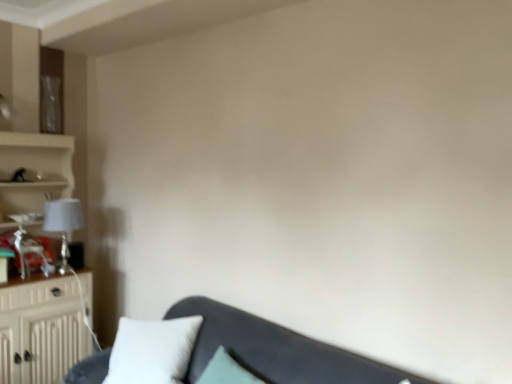
In order to face velvet dark gray couch at lower center, should I rotate leftwards or rightwards?

To face it directly, rotate left by 5.751 degrees.

What do you see at coordinates (152, 351) in the screenshot? The image size is (512, 384). I see `white soft pillow at lower left` at bounding box center [152, 351].

Where is `velvet dark gray couch at lower center`? velvet dark gray couch at lower center is located at coordinates (277, 350).

Can you confirm if velvet dark gray couch at lower center is taller than white soft pillow at lower left?

Yes.

From the picture: Is velvet dark gray couch at lower center not near white soft pillow at lower left?

No, velvet dark gray couch at lower center is in close proximity to white soft pillow at lower left.

How different are the orientations of velvet dark gray couch at lower center and white soft pillow at lower left in degrees?

The angular difference between velvet dark gray couch at lower center and white soft pillow at lower left is 37.4 degrees.

Find the location of a particular element. The image size is (512, 384). studio couch that appears below the white soft pillow at lower left (from a real-world perspective) is located at coordinates (277, 350).

Could velvet dark gray couch at lower center be considered to be inside matte white lampshade at left?

That's incorrect, velvet dark gray couch at lower center is not inside matte white lampshade at left.

Can you confirm if matte white lampshade at left is positioned to the right of velvet dark gray couch at lower center?

No, matte white lampshade at left is not to the right of velvet dark gray couch at lower center.

Considering the positions of objects white soft pillow at lower left and matte white lampshade at left in the image provided, who is behind, white soft pillow at lower left or matte white lampshade at left?

Positioned behind is matte white lampshade at left.

Can you confirm if white soft pillow at lower left is thinner than matte white lampshade at left?

Incorrect, the width of white soft pillow at lower left is not less than that of matte white lampshade at left.

From a real-world perspective, is white soft pillow at lower left positioned above or below matte white lampshade at left?

In terms of real-world spatial position, white soft pillow at lower left is below matte white lampshade at left.

Is white soft pillow at lower left taller than matte white lampshade at left?

Yes.

From a real-world perspective, is white soft pillow at lower left located higher than velvet dark gray couch at lower center?

Indeed, from a real-world perspective, white soft pillow at lower left stands above velvet dark gray couch at lower center.

The image size is (512, 384). What are the coordinates of `studio couch below the white soft pillow at lower left (from the image's perspective)` in the screenshot? It's located at (277, 350).

Is white soft pillow at lower left far from velvet dark gray couch at lower center?

No, white soft pillow at lower left is not far from velvet dark gray couch at lower center.

What's the angular difference between white soft pillow at lower left and velvet dark gray couch at lower center's facing directions?

37.4 degrees.

Does point (236, 353) come behind point (52, 205)?

No, it is not.

Is velvet dark gray couch at lower center at the right side of matte white lampshade at left?

Indeed, velvet dark gray couch at lower center is positioned on the right side of matte white lampshade at left.

Which of these two, velvet dark gray couch at lower center or matte white lampshade at left, is smaller?

With smaller size is matte white lampshade at left.

Can we say white soft pillow at lower left lies outside beige wood cabinet at left?

Indeed, white soft pillow at lower left is completely outside beige wood cabinet at left.

From the image's perspective, is white soft pillow at lower left located beneath beige wood cabinet at left?

Yes, from the image's perspective, white soft pillow at lower left is below beige wood cabinet at left.

Is the depth of white soft pillow at lower left less than that of beige wood cabinet at left?

That is True.

How many degrees apart are the facing directions of white soft pillow at lower left and beige wood cabinet at left?

The angular difference between white soft pillow at lower left and beige wood cabinet at left is 53.5 degrees.

From a real-world perspective, which object stands above the other?

Result: matte white lampshade at left.

Locate an element on the screen. This screenshot has height=384, width=512. lamp that is above the beige wood cabinet at left (from a real-world perspective) is located at coordinates (63, 224).

How different are the orientations of matte white lampshade at left and beige wood cabinet at left in degrees?

They differ by 0.00405 degrees in their facing directions.

From the image's perspective, which one is positioned lower, matte white lampshade at left or beige wood cabinet at left?

From the image's view, beige wood cabinet at left is below.

Locate an element on the screen. Image resolution: width=512 pixels, height=384 pixels. pillow above the velvet dark gray couch at lower center (from a real-world perspective) is located at coordinates (152, 351).

The image size is (512, 384). In order to click on lamp behind the velvet dark gray couch at lower center in this screenshot , I will do `click(63, 224)`.

Looking at the image, which one is located further to velvet dark gray couch at lower center, white soft pillow at lower left or matte white lampshade at left?

The object further to velvet dark gray couch at lower center is matte white lampshade at left.

Looking at the image, which one is located closer to white soft pillow at lower left, matte white lampshade at left or velvet dark gray couch at lower center?

velvet dark gray couch at lower center lies closer to white soft pillow at lower left than the other object.

Considering their positions, is beige wood cabinet at left positioned further to matte white lampshade at left than white soft pillow at lower left?

The object further to matte white lampshade at left is white soft pillow at lower left.

From the image, which object appears to be farther from velvet dark gray couch at lower center, white soft pillow at lower left or beige wood cabinet at left?

beige wood cabinet at left is further to velvet dark gray couch at lower center.

Considering their positions, is beige wood cabinet at left positioned further to white soft pillow at lower left than velvet dark gray couch at lower center?

beige wood cabinet at left.

Which object lies further to the anchor point beige wood cabinet at left, matte white lampshade at left or velvet dark gray couch at lower center?

Based on the image, velvet dark gray couch at lower center appears to be further to beige wood cabinet at left.

From the image, which object appears to be nearer to velvet dark gray couch at lower center, matte white lampshade at left or white soft pillow at lower left?

Based on the image, white soft pillow at lower left appears to be nearer to velvet dark gray couch at lower center.

Considering their positions, is white soft pillow at lower left positioned further to matte white lampshade at left than beige wood cabinet at left?

Based on the image, white soft pillow at lower left appears to be further to matte white lampshade at left.

In order to click on pillow between velvet dark gray couch at lower center and matte white lampshade at left from front to back in this screenshot , I will do `click(152, 351)`.

In order to click on pillow between velvet dark gray couch at lower center and beige wood cabinet at left from front to back in this screenshot , I will do `click(152, 351)`.

Where is `lamp between beige wood cabinet at left and white soft pillow at lower left from left to right`? The width and height of the screenshot is (512, 384). lamp between beige wood cabinet at left and white soft pillow at lower left from left to right is located at coordinates (63, 224).

Locate an element on the screen. entertainment center located between velvet dark gray couch at lower center and matte white lampshade at left in the depth direction is located at coordinates (41, 330).